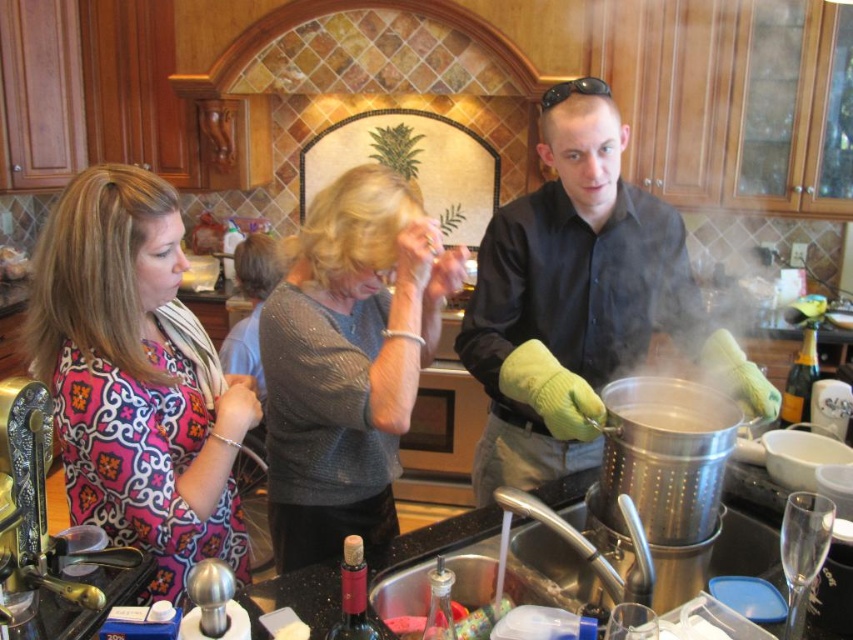
You are trying to decide which clothing item to take from the kitchen scene for a costume party. The matte black shirt at center and the sparkly gray sweater at center are both options. Which one would you choose if you want the larger size?

The matte black shirt at center is bigger than the sparkly gray sweater at center, so you should choose the matte black shirt at center for the larger size.